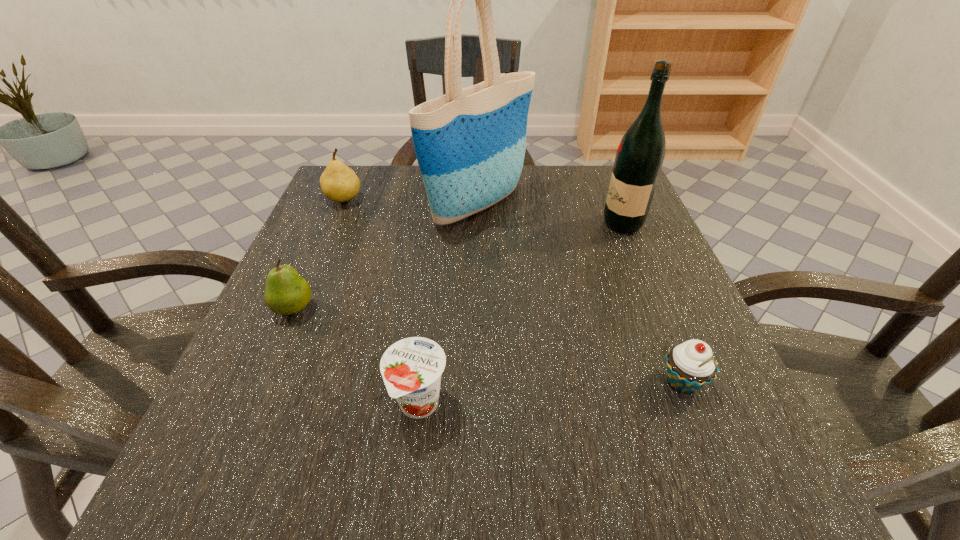
You are a GUI agent. You are given a task and a screenshot of the screen. Output one action in this format:
    pyautogui.click(x=<x>, y=<y>)
    Task: Click on the vacant space located 0.090m on the front-facing side of the liquor
    
    Given the screenshot: What is the action you would take?
    click(562, 224)

The width and height of the screenshot is (960, 540). Find the location of `free location located 0.230m on the front-facing side of the liquor`. free location located 0.230m on the front-facing side of the liquor is located at coordinates (496, 224).

Locate an element on the screen. vacant space situated 0.350m on the front of the farther pear is located at coordinates (289, 326).

Locate an element on the screen. The height and width of the screenshot is (540, 960). blank space located on the front of the nearer pear is located at coordinates (215, 489).

Find the location of `vacant point located 0.210m on the left of the cupcake`. vacant point located 0.210m on the left of the cupcake is located at coordinates (516, 382).

In order to click on vacant space located on the right of the yogurt in this screenshot , I will do `click(534, 405)`.

At what (x,y) coordinates should I click in order to perform the action: click on tote bag present at the far edge. Please return your answer as a coordinate pair (x, y). This screenshot has width=960, height=540. Looking at the image, I should click on (470, 143).

Locate an element on the screen. liquor present at the far edge is located at coordinates (640, 155).

At what (x,y) coordinates should I click in order to perform the action: click on pear present at the far edge. Please return your answer as a coordinate pair (x, y). This screenshot has height=540, width=960. Looking at the image, I should click on (339, 183).

At what (x,y) coordinates should I click in order to perform the action: click on liquor situated at the right edge. Please return your answer as a coordinate pair (x, y). Looking at the image, I should click on (640, 155).